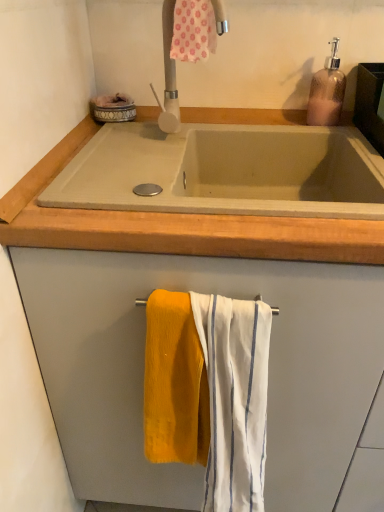
The width and height of the screenshot is (384, 512). Describe the element at coordinates (235, 398) in the screenshot. I see `white striped fabric at center, placed as the 1th bath towel when sorted from bottom to top` at that location.

Identify the location of white striped fabric at center, placed as the 1th bath towel when sorted from bottom to top. The height and width of the screenshot is (512, 384). (235, 398).

Locate an element on the screen. soft yellow towel at lower center, arranged as the second bath towel when ordered from the bottom is located at coordinates (174, 383).

This screenshot has height=512, width=384. What are the coordinates of `translucent brown soap dispenser at upper right` in the screenshot? It's located at (327, 92).

Could you measure the distance between translucent brown soap dispenser at upper right and soft yellow towel at lower center, arranged as the second bath towel when ordered from the bottom?

translucent brown soap dispenser at upper right is 27.01 inches from soft yellow towel at lower center, arranged as the second bath towel when ordered from the bottom.

From a real-world perspective, relative to soft yellow towel at lower center, acting as the second bath towel starting from the top, is translucent brown soap dispenser at upper right vertically above or below?

From a real-world perspective, translucent brown soap dispenser at upper right is physically above soft yellow towel at lower center, acting as the second bath towel starting from the top.

Is translucent brown soap dispenser at upper right positioned far away from soft yellow towel at lower center, acting as the second bath towel starting from the top?

No, there isn't a large distance between translucent brown soap dispenser at upper right and soft yellow towel at lower center, acting as the second bath towel starting from the top.

Between translucent brown soap dispenser at upper right and soft yellow towel at lower center, arranged as the second bath towel when ordered from the bottom, which one has larger width?

With larger width is translucent brown soap dispenser at upper right.

From the image's perspective, is translucent brown soap dispenser at upper right on white striped fabric at center, placed as the 1th bath towel when sorted from bottom to top?

Yes, from the image's perspective, translucent brown soap dispenser at upper right is above white striped fabric at center, placed as the 1th bath towel when sorted from bottom to top.

Measure the distance from translucent brown soap dispenser at upper right to white striped fabric at center, placed as the 1th bath towel when sorted from bottom to top.

translucent brown soap dispenser at upper right and white striped fabric at center, placed as the 1th bath towel when sorted from bottom to top, are 26.57 inches apart.

Does point (314, 100) lie behind point (207, 462)?

Yes, it is.

Is translucent brown soap dispenser at upper right to the right of white striped fabric at center, placed as the 1th bath towel when sorted from bottom to top, from the viewer's perspective?

Correct, you'll find translucent brown soap dispenser at upper right to the right of white striped fabric at center, placed as the 1th bath towel when sorted from bottom to top.

Can you confirm if white striped fabric at center, placed as the 1th bath towel when sorted from bottom to top, is positioned to the left of concrete sink at center?

Incorrect, white striped fabric at center, placed as the 1th bath towel when sorted from bottom to top, is not on the left side of concrete sink at center.

Which is correct: white striped fabric at center, placed as the 1th bath towel when sorted from bottom to top, is inside concrete sink at center, or outside of it?

white striped fabric at center, placed as the 1th bath towel when sorted from bottom to top, is not enclosed by concrete sink at center.

Considering the sizes of white striped fabric at center, placed as the 1th bath towel when sorted from bottom to top, and concrete sink at center in the image, is white striped fabric at center, placed as the 1th bath towel when sorted from bottom to top, wider or thinner than concrete sink at center?

white striped fabric at center, placed as the 1th bath towel when sorted from bottom to top, is thinner than concrete sink at center.

How far apart are soft yellow towel at lower center, arranged as the second bath towel when ordered from the bottom, and white striped fabric at center, the 3th bath towel positioned from the top?

A distance of 2.26 inches exists between soft yellow towel at lower center, arranged as the second bath towel when ordered from the bottom, and white striped fabric at center, the 3th bath towel positioned from the top.

Which object is positioned more to the left, soft yellow towel at lower center, arranged as the second bath towel when ordered from the bottom, or white striped fabric at center, placed as the 1th bath towel when sorted from bottom to top?

soft yellow towel at lower center, arranged as the second bath towel when ordered from the bottom, is more to the left.

In the image, is soft yellow towel at lower center, arranged as the second bath towel when ordered from the bottom, positioned in front of or behind white striped fabric at center, placed as the 1th bath towel when sorted from bottom to top?

Clearly, soft yellow towel at lower center, arranged as the second bath towel when ordered from the bottom, is behind white striped fabric at center, placed as the 1th bath towel when sorted from bottom to top.

Is soft yellow towel at lower center, arranged as the second bath towel when ordered from the bottom, bigger than white striped fabric at center, the 3th bath towel positioned from the top?

Actually, soft yellow towel at lower center, arranged as the second bath towel when ordered from the bottom, might be smaller than white striped fabric at center, the 3th bath towel positioned from the top.

Is soft yellow towel at lower center, arranged as the second bath towel when ordered from the bottom, facing away from pink floral fabric at upper center, which ranks as the first bath towel in top-to-bottom order?

No, pink floral fabric at upper center, which ranks as the first bath towel in top-to-bottom order, is not at the back of soft yellow towel at lower center, arranged as the second bath towel when ordered from the bottom.

From a real-world perspective, is soft yellow towel at lower center, acting as the second bath towel starting from the top, on top of pink floral fabric at upper center, marked as the 3th bath towel in a bottom-to-top arrangement?

No.

Is soft yellow towel at lower center, arranged as the second bath towel when ordered from the bottom, directly adjacent to pink floral fabric at upper center, which ranks as the first bath towel in top-to-bottom order?

No, soft yellow towel at lower center, arranged as the second bath towel when ordered from the bottom, is not touching pink floral fabric at upper center, which ranks as the first bath towel in top-to-bottom order.

Image resolution: width=384 pixels, height=512 pixels. In order to click on bath towel that is the 1st object directly below the pink floral fabric at upper center, marked as the 3th bath towel in a bottom-to-top arrangement (from a real-world perspective) in this screenshot , I will do click(174, 383).

Does soft yellow towel at lower center, acting as the second bath towel starting from the top, have a smaller size compared to white matte tap at upper center?

Yes.

From a real-world perspective, is soft yellow towel at lower center, acting as the second bath towel starting from the top, above or below white matte tap at upper center?

soft yellow towel at lower center, acting as the second bath towel starting from the top, is situated lower than white matte tap at upper center in the real world.

Which is more to the left, soft yellow towel at lower center, arranged as the second bath towel when ordered from the bottom, or white matte tap at upper center?

Positioned to the left is soft yellow towel at lower center, arranged as the second bath towel when ordered from the bottom.

Is point (112, 166) in front of point (169, 24)?

Yes.

Who is taller, concrete sink at center or white matte tap at upper center?

Standing taller between the two is white matte tap at upper center.

Identify the location of tap above the concrete sink at center (from the image's perspective). The height and width of the screenshot is (512, 384). (168, 42).

Considering the positions of objects concrete sink at center and white matte tap at upper center in the image provided, who is behind, concrete sink at center or white matte tap at upper center?

Positioned behind is white matte tap at upper center.

Identify the location of soap dispenser behind the soft yellow towel at lower center, arranged as the second bath towel when ordered from the bottom. (327, 92).

Find the location of `soap dispenser above the white striped fabric at center, the 3th bath towel positioned from the top (from a real-world perspective)`. soap dispenser above the white striped fabric at center, the 3th bath towel positioned from the top (from a real-world perspective) is located at coordinates (327, 92).

Which object lies nearer to the anchor point white matte tap at upper center, pink floral fabric at upper center, marked as the 3th bath towel in a bottom-to-top arrangement, or soft yellow towel at lower center, arranged as the second bath towel when ordered from the bottom?

pink floral fabric at upper center, marked as the 3th bath towel in a bottom-to-top arrangement, is positioned closer to the anchor white matte tap at upper center.

From the image, which object appears to be farther from white matte tap at upper center, translucent brown soap dispenser at upper right or pink floral fabric at upper center, marked as the 3th bath towel in a bottom-to-top arrangement?

Based on the image, translucent brown soap dispenser at upper right appears to be further to white matte tap at upper center.

From the image, which object appears to be farther from white striped fabric at center, the 3th bath towel positioned from the top, white matte tap at upper center or translucent brown soap dispenser at upper right?

The object further to white striped fabric at center, the 3th bath towel positioned from the top, is translucent brown soap dispenser at upper right.

Looking at the image, which one is located closer to soft yellow towel at lower center, acting as the second bath towel starting from the top, white striped fabric at center, placed as the 1th bath towel when sorted from bottom to top, or concrete sink at center?

white striped fabric at center, placed as the 1th bath towel when sorted from bottom to top, is positioned closer to the anchor soft yellow towel at lower center, acting as the second bath towel starting from the top.

Based on their spatial positions, is white matte tap at upper center or pink floral fabric at upper center, marked as the 3th bath towel in a bottom-to-top arrangement, further from soft yellow towel at lower center, acting as the second bath towel starting from the top?

pink floral fabric at upper center, marked as the 3th bath towel in a bottom-to-top arrangement, is positioned further to the anchor soft yellow towel at lower center, acting as the second bath towel starting from the top.

Considering their positions, is white matte tap at upper center positioned further to pink floral fabric at upper center, marked as the 3th bath towel in a bottom-to-top arrangement, than white striped fabric at center, placed as the 1th bath towel when sorted from bottom to top?

white striped fabric at center, placed as the 1th bath towel when sorted from bottom to top, is further to pink floral fabric at upper center, marked as the 3th bath towel in a bottom-to-top arrangement.

Considering their positions, is translucent brown soap dispenser at upper right positioned further to soft yellow towel at lower center, acting as the second bath towel starting from the top, than pink floral fabric at upper center, marked as the 3th bath towel in a bottom-to-top arrangement?

Among the two, translucent brown soap dispenser at upper right is located further to soft yellow towel at lower center, acting as the second bath towel starting from the top.

When comparing their distances from soft yellow towel at lower center, arranged as the second bath towel when ordered from the bottom, does translucent brown soap dispenser at upper right or white striped fabric at center, placed as the 1th bath towel when sorted from bottom to top, seem closer?

The object closer to soft yellow towel at lower center, arranged as the second bath towel when ordered from the bottom, is white striped fabric at center, placed as the 1th bath towel when sorted from bottom to top.

Image resolution: width=384 pixels, height=512 pixels. What are the coordinates of `tap between translucent brown soap dispenser at upper right and white striped fabric at center, placed as the 1th bath towel when sorted from bottom to top, in the up-down direction` in the screenshot? It's located at (168, 42).

Locate an element on the screen. The height and width of the screenshot is (512, 384). bath towel between pink floral fabric at upper center, marked as the 3th bath towel in a bottom-to-top arrangement, and white striped fabric at center, the 3th bath towel positioned from the top, from top to bottom is located at coordinates (174, 383).

This screenshot has width=384, height=512. Identify the location of bath between white matte tap at upper center and soft yellow towel at lower center, arranged as the second bath towel when ordered from the bottom, in the vertical direction. (225, 170).

You are a GUI agent. You are given a task and a screenshot of the screen. Output one action in this format:
    pyautogui.click(x=<x>, y=<y>)
    Task: Click on the bath between pink floral fabric at upper center, marked as the 3th bath towel in a bottom-to-top arrangement, and white striped fabric at center, the 3th bath towel positioned from the top, in the vertical direction
    This screenshot has width=384, height=512.
    Given the screenshot: What is the action you would take?
    pyautogui.click(x=225, y=170)